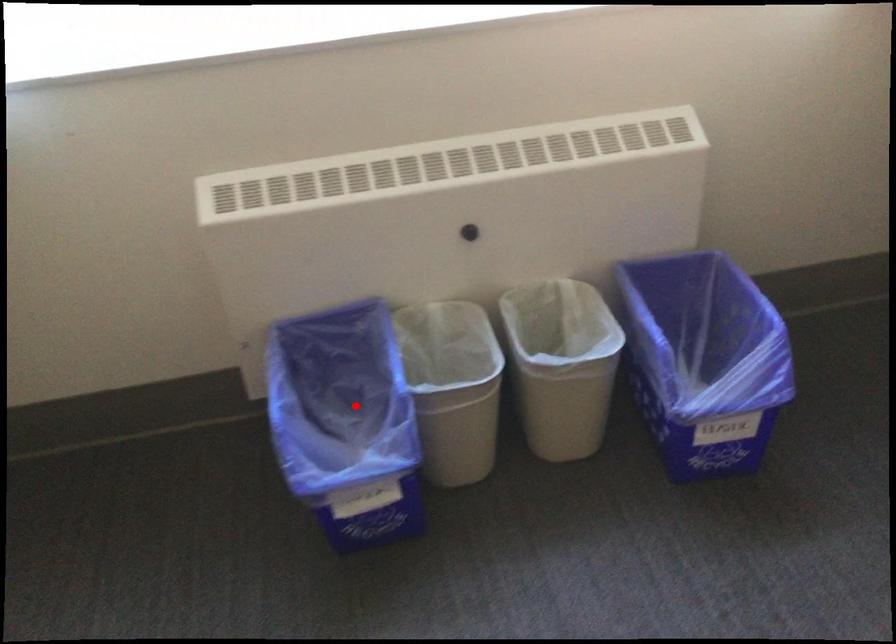
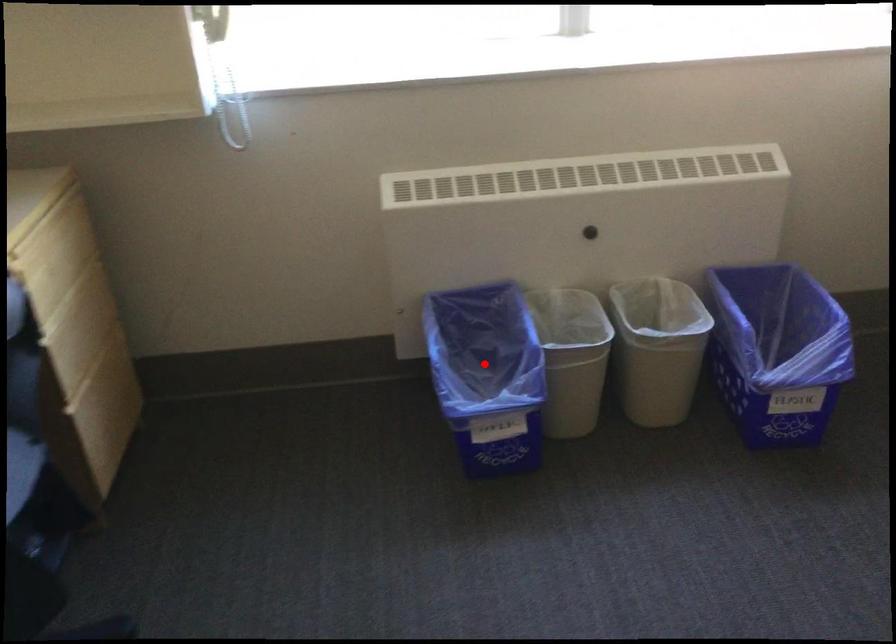
I am providing you with two images of the same scene from different viewpoints. A red point is marked on the first image and another point is marked on the second image. Do the highlighted points in image1 and image2 indicate the same real-world spot?

Yes